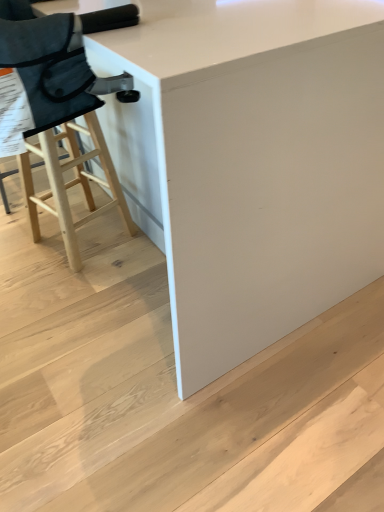
Question: Is white matte stair at lower center bigger or smaller than white glossy table at center?

Choices:
 (A) big
 (B) small

Answer: (B)

Question: From the image's perspective, is white matte stair at lower center above or below white glossy table at center?

Choices:
 (A) above
 (B) below

Answer: (B)

Question: Based on their relative distances, which object is farther from the white glossy table at center?

Choices:
 (A) white matte stair at lower center
 (B) natural wood stool at left

Answer: (B)

Question: Estimate the real-world distances between objects in this image. Which object is closer to the white matte stair at lower center?

Choices:
 (A) white glossy table at center
 (B) natural wood stool at left

Answer: (A)